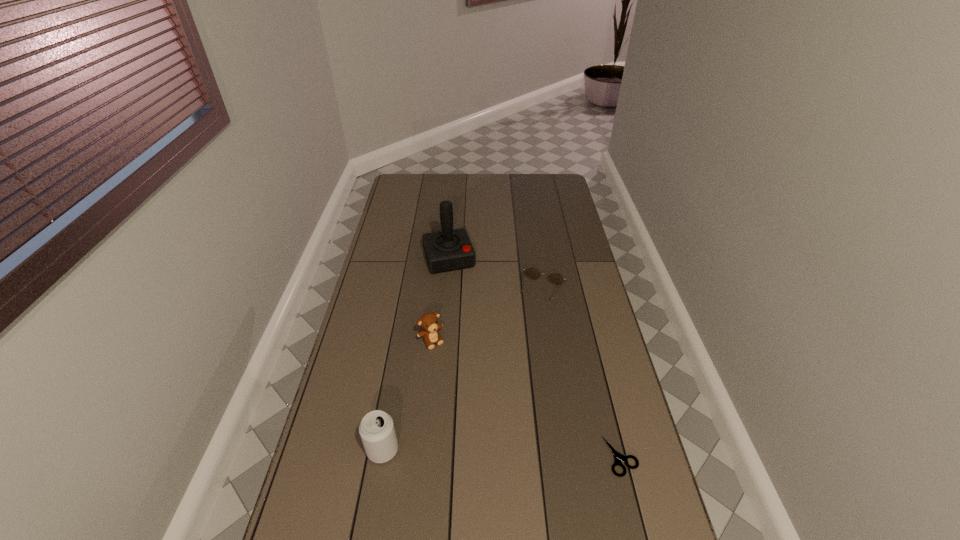
Identify the location of free space on the desktop that is between the can and the shortest object and is positioned on the front-facing side of the fourth tallest object. The width and height of the screenshot is (960, 540). (482, 453).

You are a GUI agent. You are given a task and a screenshot of the screen. Output one action in this format:
    pyautogui.click(x=<x>, y=<y>)
    Task: Click on the free spot on the desktop that is between the second tallest object and the shears and is positioned on the base of the joystick
    This screenshot has height=540, width=960.
    Given the screenshot: What is the action you would take?
    pyautogui.click(x=514, y=454)

Locate an element on the screen. free space on the desktop that is between the second tallest object and the rightmost object and is positioned on the face of the teddy bear is located at coordinates (509, 453).